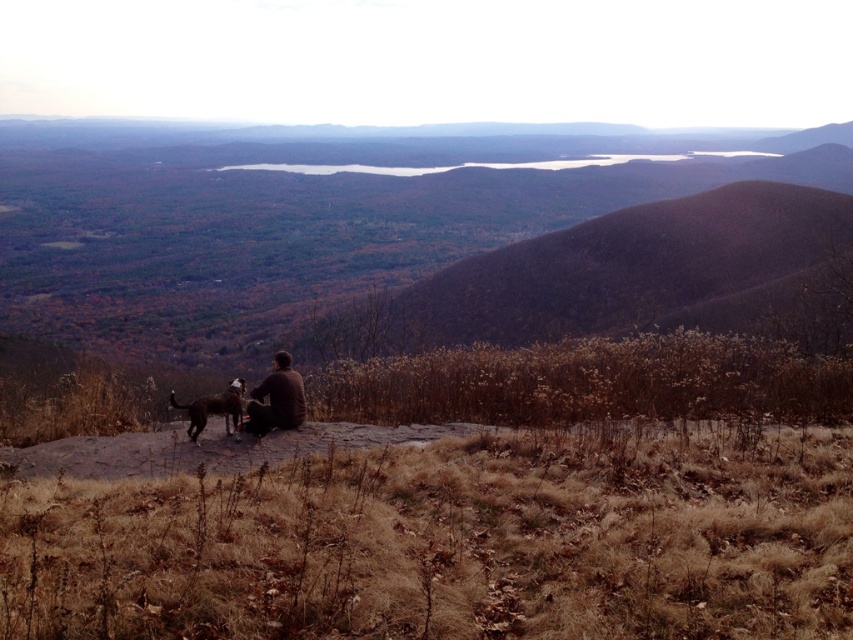
You are standing at the point with coordinates point (x=231, y=406) and want to move towards the point with coordinates point (x=252, y=392). Which direction should you move to get closer to it?

Since point (x=252, y=392) is further to the viewer than point (x=231, y=406), you should move forward towards it.

You are planning to take a photo of the two subjects at the center of the scene. Since you want to ensure both the brown soft jacket at center and the brown fur dog at center are clearly visible, which one should you focus on first to avoid blurring due to their size difference?

The brown soft jacket at center is bigger than the brown fur dog at center. Therefore, you should focus on the brown fur dog at center first, as it is smaller and might be more challenging to capture clearly in the frame.

You are trying to decide whether to take the brown soft jacket at center or the brown fur dog at center with you on a hike. Based on their sizes, which one can you more easily fold or compress to fit into your backpack?

The brown soft jacket at center is thinner than the brown fur dog at center, so the brown soft jacket at center can be more easily folded or compressed to fit into your backpack.